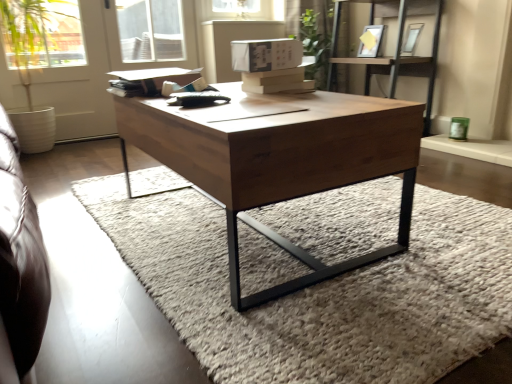
Identify the location of vacant space situated above soft wool rug at center (from a real-world perspective). (282, 243).